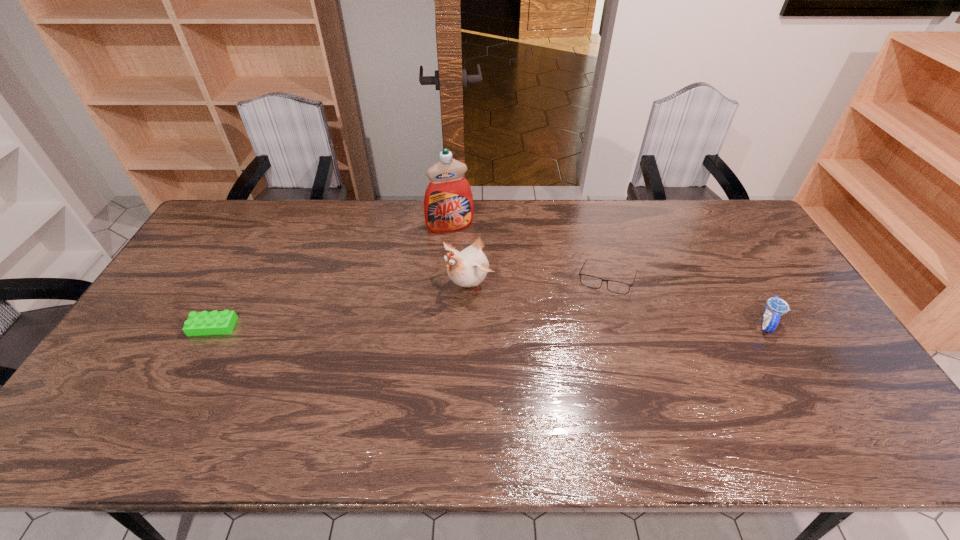
At what (x,y) coordinates should I click in order to perform the action: click on vacant space located on the back of the rightmost object. Please return your answer as a coordinate pair (x, y). Image resolution: width=960 pixels, height=540 pixels. Looking at the image, I should click on (708, 223).

Where is `vacant area located 0.080m with the lenses facing outward on the fourth tallest object`? The image size is (960, 540). vacant area located 0.080m with the lenses facing outward on the fourth tallest object is located at coordinates (566, 303).

Identify the location of vacant space located 0.070m with the lenses facing outward on the fourth tallest object. (569, 302).

Locate an element on the screen. free space located 0.240m with the lenses facing outward on the fourth tallest object is located at coordinates (526, 330).

Identify the location of blank space located on the front surface of the detergent. (472, 273).

Locate an element on the screen. The height and width of the screenshot is (540, 960). free space located on the front surface of the detergent is located at coordinates (477, 284).

Identify the location of vacant space located 0.260m on the front surface of the detergent. The width and height of the screenshot is (960, 540). (478, 286).

Locate an element on the screen. vacant space positioned at the beak of the second tallest object is located at coordinates (367, 368).

This screenshot has height=540, width=960. Find the location of `free region located 0.140m at the beak of the second tallest object`. free region located 0.140m at the beak of the second tallest object is located at coordinates (417, 327).

Find the location of a particular element. vacant region located 0.130m at the beak of the second tallest object is located at coordinates (420, 325).